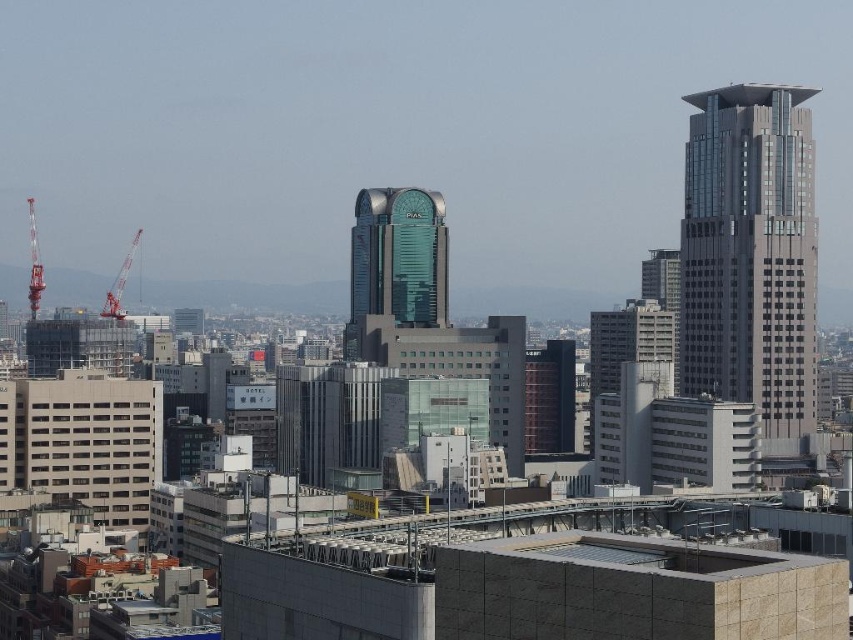
Question: Which object is the closest to the glassy gray skyscraper at right?

Choices:
 (A) metallic red crane at left
 (B) orange metallic crane at left

Answer: (B)

Question: Which object appears farthest from the camera in this image?

Choices:
 (A) orange metallic crane at left
 (B) glassy gray skyscraper at right

Answer: (A)

Question: Is green glass tower at center behind metallic red crane at left?

Choices:
 (A) yes
 (B) no

Answer: (B)

Question: Is glassy gray skyscraper at right below orange metallic crane at left?

Choices:
 (A) no
 (B) yes

Answer: (A)

Question: Which of the following is the closest to the observer?

Choices:
 (A) green glass tower at center
 (B) orange metallic crane at left

Answer: (A)

Question: Can you confirm if metallic red crane at left is wider than orange metallic crane at left?

Choices:
 (A) no
 (B) yes

Answer: (A)